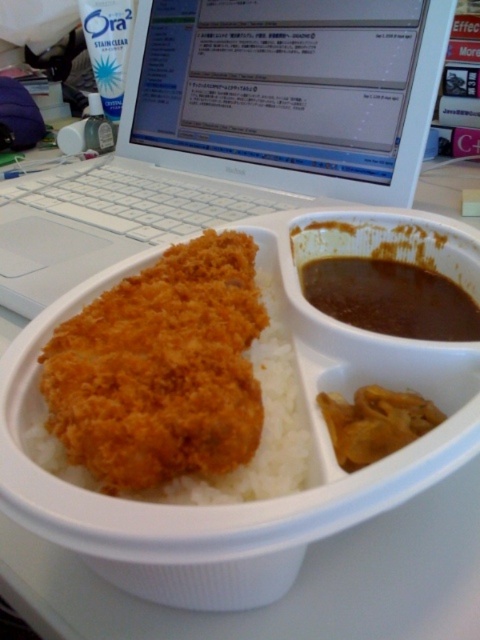
Question: Does white plastic laptop at upper center come behind brown thick gravy at lower right?

Choices:
 (A) no
 (B) yes

Answer: (B)

Question: Does white plastic laptop at upper center have a lesser width compared to golden crispy breaded cutlet at center?

Choices:
 (A) no
 (B) yes

Answer: (A)

Question: Is white plastic laptop at upper center bigger than golden crispy breaded cutlet at center?

Choices:
 (A) no
 (B) yes

Answer: (B)

Question: Based on their relative distances, which object is farther from the brown thick gravy at lower right?

Choices:
 (A) brown crumbly curry at center
 (B) white plastic laptop at upper center
 (C) golden crispy breaded cutlet at center

Answer: (B)

Question: Which of the following is the closest to the observer?

Choices:
 (A) white plastic laptop at upper center
 (B) brown thick gravy at lower right
 (C) brown crumbly curry at center
 (D) golden crispy breaded cutlet at center

Answer: (D)

Question: Which point is farther to the camera?

Choices:
 (A) white plastic laptop at upper center
 (B) brown thick gravy at lower right
 (C) golden crispy breaded cutlet at center

Answer: (A)